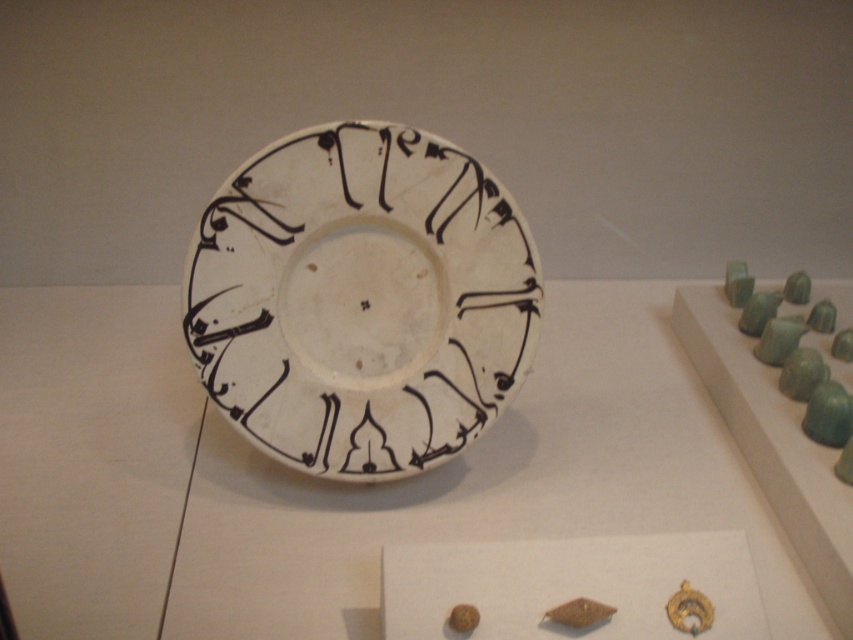
Is point (270, 291) more distant than point (807, 289)?

No, (270, 291) is closer to viewer.

Can you confirm if white glossy plate at center is smaller than green jade beads at right?

Correct, white glossy plate at center occupies less space than green jade beads at right.

Between point (486, 378) and point (846, 332), which one is positioned in front?

Point (486, 378) is more forward.

The image size is (853, 640). What are the coordinates of `white glossy plate at center` in the screenshot? It's located at (361, 300).